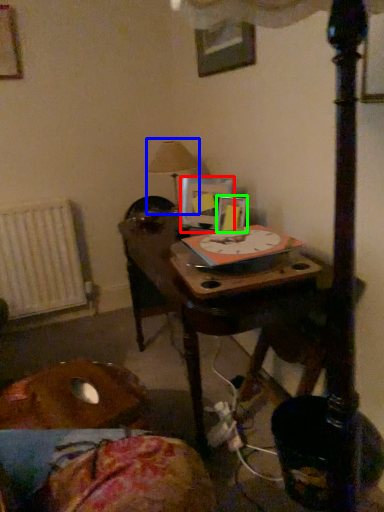
Question: Based on their relative distances, which object is farther from picture frame (highlighted by a red box)? Choose from table lamp (highlighted by a blue box) and picture frame (highlighted by a green box).

Choices:
 (A) table lamp
 (B) picture frame

Answer: (A)